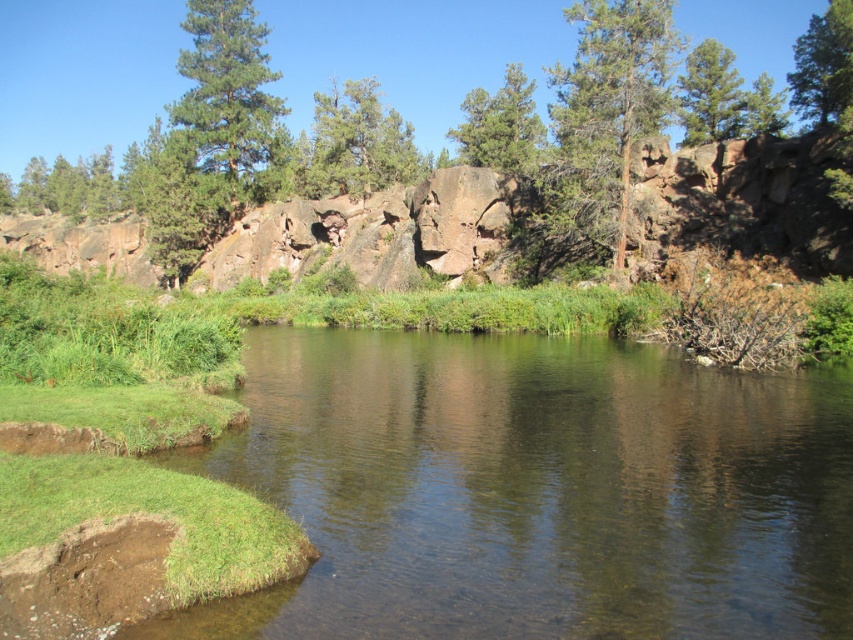
Does green rough bark tree at upper center have a smaller size compared to green textured pine tree at upper left?

No, green rough bark tree at upper center is not smaller than green textured pine tree at upper left.

Consider the image. Which of these two, green rough bark tree at upper center or green textured pine tree at upper left, stands shorter?

green textured pine tree at upper left is shorter.

Describe the element at coordinates (610, 106) in the screenshot. I see `green rough bark tree at upper center` at that location.

Where is `green rough bark tree at upper center`? The width and height of the screenshot is (853, 640). green rough bark tree at upper center is located at coordinates (610, 106).

Is point (196, 465) closer to camera compared to point (735, 74)?

Yes, it is in front of point (735, 74).

Can you confirm if clear water at center is positioned to the right of green matte tree at upper center?

No, clear water at center is not to the right of green matte tree at upper center.

At what (x,y) coordinates should I click in order to perform the action: click on clear water at center. Please return your answer as a coordinate pair (x, y). The width and height of the screenshot is (853, 640). Looking at the image, I should click on (535, 490).

Locate an element on the screen. This screenshot has height=640, width=853. clear water at center is located at coordinates (535, 490).

Is point (384, 186) closer to viewer compared to point (689, 140)?

No, (384, 186) is behind (689, 140).

Is green textured tree at upper center above green matte tree at upper center?

Yes.

What do you see at coordinates (355, 144) in the screenshot? I see `green textured tree at upper center` at bounding box center [355, 144].

Locate an element on the screen. The height and width of the screenshot is (640, 853). green textured tree at upper center is located at coordinates (355, 144).